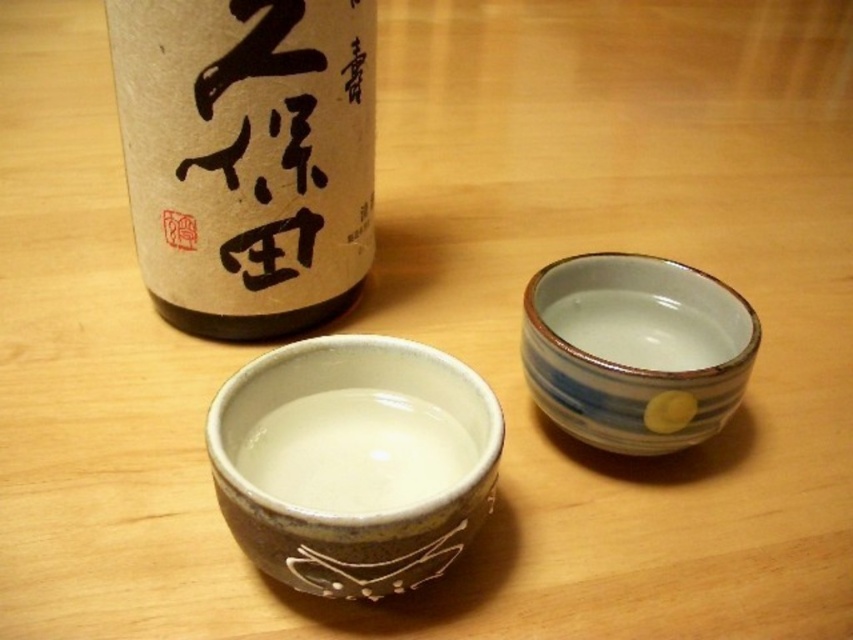
You are a guest at a traditional Japanese tea ceremony and are seated between two objects. One is the matte ceramic bowl at center and the other is the bottle of sake in the background. The host asks you to pass the bottle of sake to them without moving from your seat. Can you reach it?

The distance between the matte ceramic bowl at center and the bottle of sake in the background is 31.50 inches. Since you are seated between them, the bottle of sake is 31.50 inches away from you, which may be too far to reach comfortably without moving.

You are a visitor at a traditional Japanese sake tasting event. You see two points in the scene. The first point is at coordinate point (331, 438) and the second point is at coordinate point (740, 344). Which point is closer to you?

Point (331, 438) is closer to the viewer than point (740, 344).

You are a visitor at a traditional Japanese sake tasting event. You see two points marked in the image. One is point (225, 227) and the other is point (236, 513). Which point is closer to you?

Point (225, 227) is closer to you because it is further to the viewer than point (236, 513).